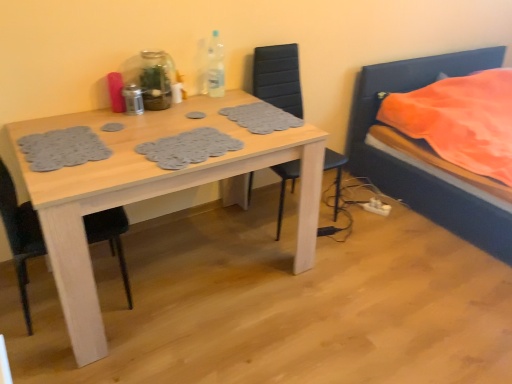
Where is `free space in front of black leather chair at center, marked as the 2th chair in a left-to-right arrangement`? The width and height of the screenshot is (512, 384). free space in front of black leather chair at center, marked as the 2th chair in a left-to-right arrangement is located at coordinates (338, 266).